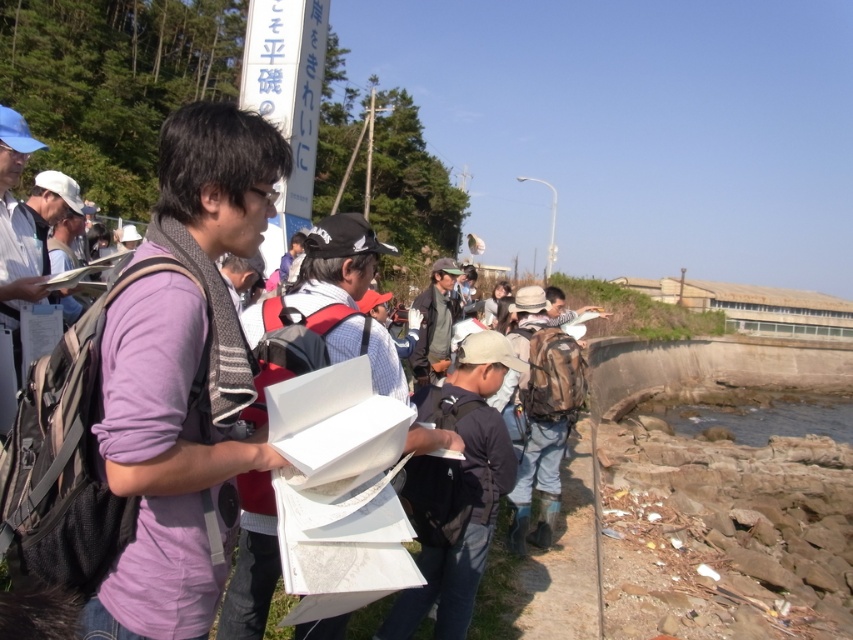
You are planning to place a small boat in the scene. The boat requires a body of water wider than the dark green jacket at center. Based on the scene description, can you confirm if the clear water at lower right is wide enough to accommodate the boat?

The clear water at lower right has a width that surpasses the dark green jacket at center, so yes, the clear water at lower right is wide enough to accommodate the boat.

You are a photographer trying to capture a group photo of the purple matte shirt at center and the dark green jacket at center. If you want to ensure both subjects appear equally sized in the photo, which subject should you move closer to the camera?

The purple matte shirt at center has a smaller size compared to dark green jacket at center. To make them appear equally sized in the photo, move the purple matte shirt at center closer to the camera since it is smaller and needs to be magnified to match the size of the dark green jacket at center.

You are a photographer trying to capture a group photo of the purple matte shirt at center and clear water at lower right. If the camera can only focus on objects wider than 1 meter, will both subjects fit in the frame?

The purple matte shirt at center is narrower than the clear water at lower right. Since the camera requires objects wider than 1 meter, the clear water at lower right may fit, but the purple matte shirt at center might not meet the width requirement. Check their actual measurements.